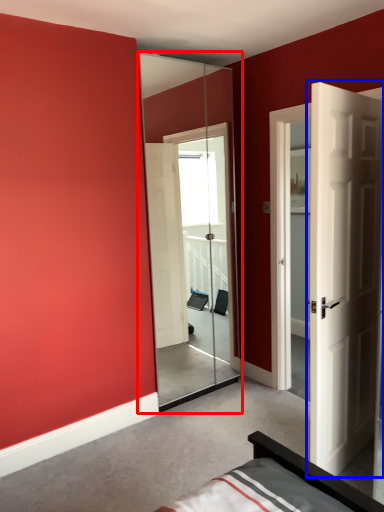
Question: Which point is further to the camera, screen door (highlighted by a red box) or door (highlighted by a blue box)?

Choices:
 (A) screen door
 (B) door

Answer: (A)